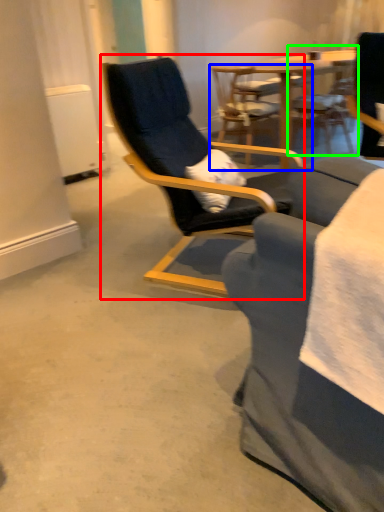
Question: Which object is positioned farthest from chair (highlighted by a red box)? Select from chair (highlighted by a blue box) and chair (highlighted by a green box).

Choices:
 (A) chair
 (B) chair

Answer: (B)